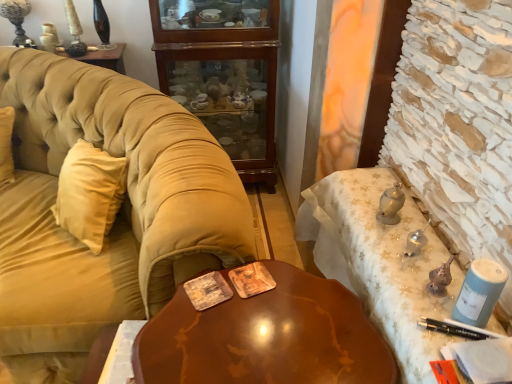
Identify the location of free space above glossy wood table at center (from a real-world perspective). The height and width of the screenshot is (384, 512). (250, 321).